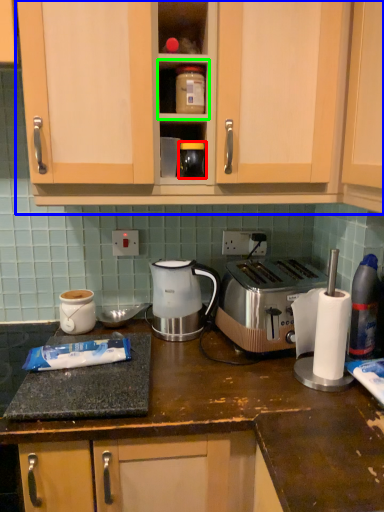
Question: Which object is the farthest from appliance (highlighted by a red box)? Choose among these: cabinetry (highlighted by a blue box) or shelf (highlighted by a green box).

Choices:
 (A) cabinetry
 (B) shelf

Answer: (A)